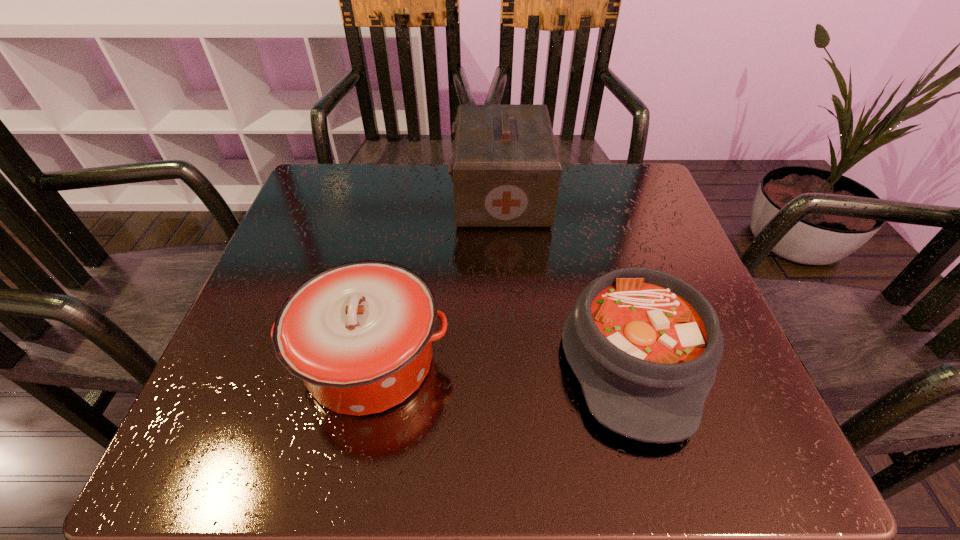
In order to click on object present at the left edge in this screenshot , I will do `click(359, 334)`.

Where is `object present at the right edge`? The image size is (960, 540). object present at the right edge is located at coordinates (645, 345).

The height and width of the screenshot is (540, 960). Identify the location of object that is at the near left corner. (359, 334).

The image size is (960, 540). Find the location of `object that is at the near right corner`. object that is at the near right corner is located at coordinates (645, 345).

You are a GUI agent. You are given a task and a screenshot of the screen. Output one action in this format:
    pyautogui.click(x=<x>, y=<y>)
    Task: Click on the free space at the far edge
    The image size is (960, 540).
    Given the screenshot: What is the action you would take?
    pyautogui.click(x=575, y=208)

I want to click on vacant space at the near edge of the desktop, so click(479, 424).

Where is `vacant space at the right edge of the desktop`? This screenshot has width=960, height=540. vacant space at the right edge of the desktop is located at coordinates (620, 256).

This screenshot has width=960, height=540. In the image, there is a desktop. What are the coordinates of `vacant area at the far left corner` in the screenshot? It's located at (360, 194).

Locate an element on the screen. Image resolution: width=960 pixels, height=540 pixels. blank space at the near left corner is located at coordinates (253, 422).

In the image, there is a desktop. In order to click on vacant space at the far right corner in this screenshot , I will do `click(620, 179)`.